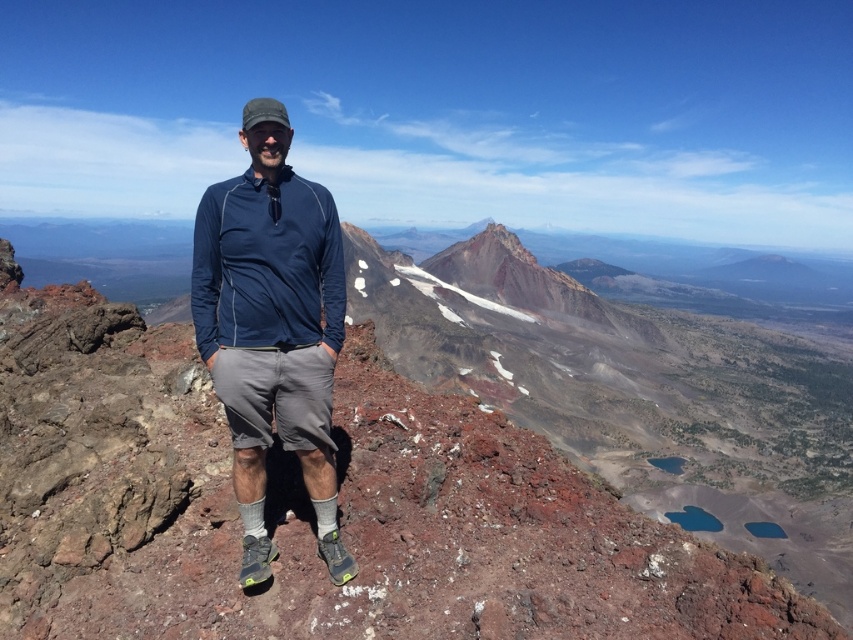
What do you see at coordinates (340, 493) in the screenshot? I see `rustic volcanic rock at center` at bounding box center [340, 493].

Is rustic volcanic rock at center wider than navy blue fabric shirt at center?

Correct, the width of rustic volcanic rock at center exceeds that of navy blue fabric shirt at center.

Is point (161, 339) less distant than point (300, 214)?

That is False.

Locate an element on the screen. rustic volcanic rock at center is located at coordinates (340, 493).